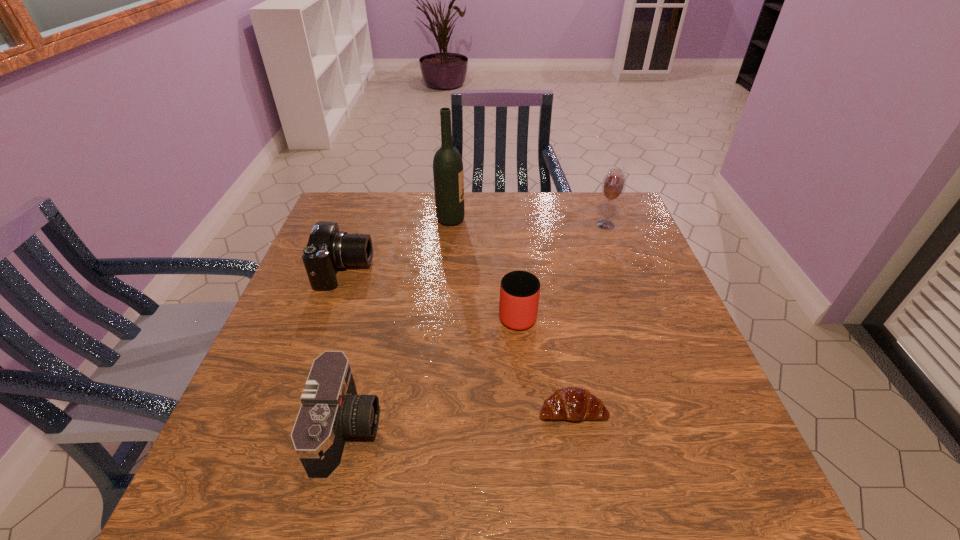
Where is `free space between the farther camera and the shortest object`? The height and width of the screenshot is (540, 960). free space between the farther camera and the shortest object is located at coordinates (458, 340).

Where is `free spot between the shortest object and the nearer camera`? free spot between the shortest object and the nearer camera is located at coordinates (460, 420).

Where is `vacant space that's between the nearer camera and the fourth farthest object`? The width and height of the screenshot is (960, 540). vacant space that's between the nearer camera and the fourth farthest object is located at coordinates (432, 371).

Locate an element on the screen. The height and width of the screenshot is (540, 960). vacant space in between the fourth nearest object and the cup is located at coordinates (431, 292).

Image resolution: width=960 pixels, height=540 pixels. I want to click on unoccupied position between the cup and the second tallest object, so click(562, 269).

Locate an element on the screen. The image size is (960, 540). vacant area that lies between the crescent roll and the nearer camera is located at coordinates coord(460,420).

This screenshot has width=960, height=540. What are the coordinates of `empty space between the crescent roll and the nearer camera` in the screenshot? It's located at (460, 420).

Locate which object ranks fifth in proximity to the tallest object. Please provide its 2D coordinates. Your answer should be formatted as a tuple, i.e. [(x, y)], where the tuple contains the x and y coordinates of a point satisfying the conditions above.

[(572, 403)]

Find the location of a particular element. The height and width of the screenshot is (540, 960). object that stands as the third closest to the second tallest object is located at coordinates (572, 403).

Locate an element on the screen. The width and height of the screenshot is (960, 540). vacant area in the image that satisfies the following two spatial constraints: 1. on the labeled side of the third object from left to right; 2. on the right side of the shortest object is located at coordinates (434, 409).